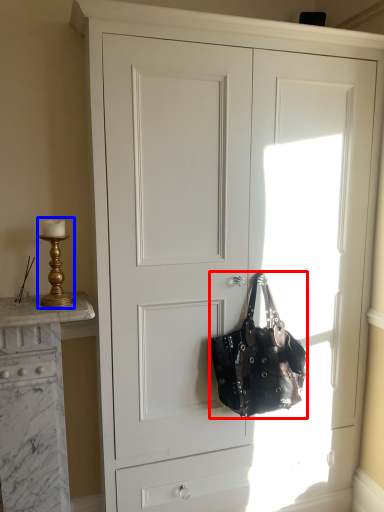
Question: Which point is further to the camera, handbag (highlighted by a red box) or table lamp (highlighted by a blue box)?

Choices:
 (A) handbag
 (B) table lamp

Answer: (A)